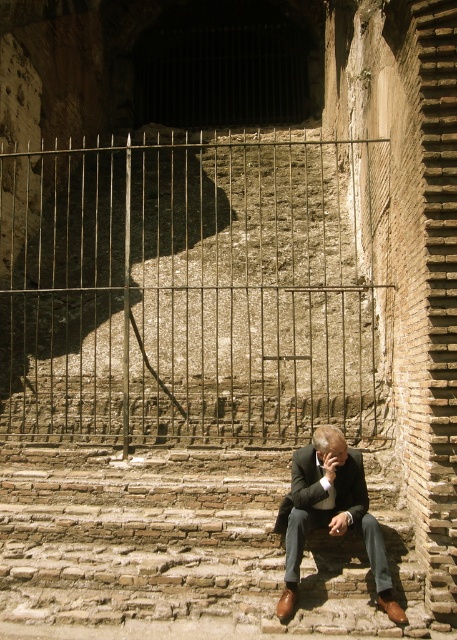
Question: Does rusty metal gate at center appear under dark brown leather suit at lower center?

Choices:
 (A) no
 (B) yes

Answer: (A)

Question: Is rusty metal gate at center smaller than dark brown leather suit at lower center?

Choices:
 (A) yes
 (B) no

Answer: (B)

Question: Does rusty metal gate at center have a lesser width compared to dark brown leather suit at lower center?

Choices:
 (A) no
 (B) yes

Answer: (A)

Question: Which of the following is the farthest from the observer?

Choices:
 (A) click(356, 243)
 (B) click(334, 465)

Answer: (A)